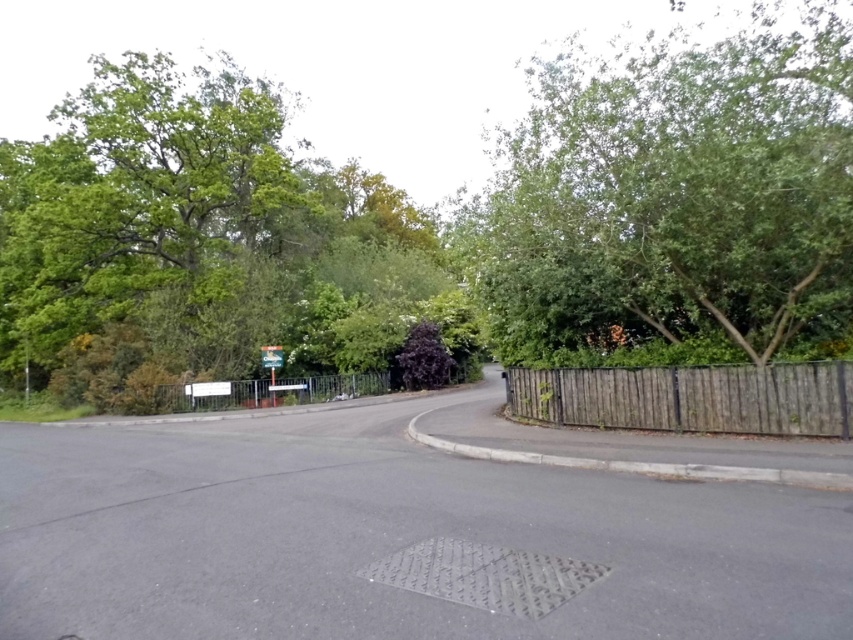
Question: Can you confirm if green leafy tree at upper right is bigger than metallic silver fence at center?

Choices:
 (A) yes
 (B) no

Answer: (A)

Question: Among these objects, which one is nearest to the camera?

Choices:
 (A) brown wooden fence at right
 (B) green leafy tree at upper right
 (C) metallic silver fence at center

Answer: (B)

Question: Does green leafy tree at upper right have a larger size compared to white plastic sign at upper center?

Choices:
 (A) yes
 (B) no

Answer: (A)

Question: Among these objects, which one is nearest to the camera?

Choices:
 (A) metallic silver fence at center
 (B) white plastic sign at upper center
 (C) brown wooden fence at right
 (D) green leafy tree at upper right

Answer: (D)

Question: Is green leafy tree at upper left thinner than blue plastic sign at center?

Choices:
 (A) yes
 (B) no

Answer: (B)

Question: Which point is closer to the camera?

Choices:
 (A) metallic silver fence at center
 (B) brown wooden fence at right
 (C) green leafy tree at upper left
 (D) white plastic sign at upper center

Answer: (B)